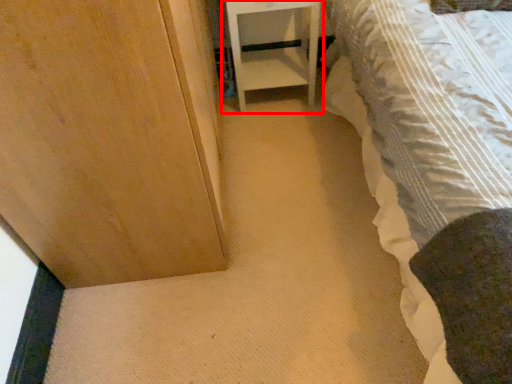
Question: From the image's perspective, what is the correct spatial relationship of furniture (annotated by the red box) in relation to bed?

Choices:
 (A) above
 (B) below

Answer: (A)